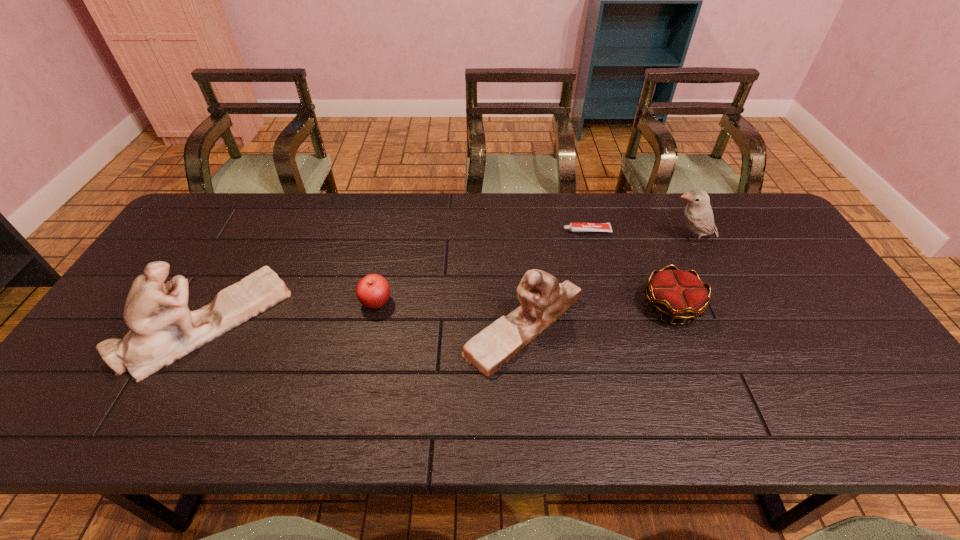
At what (x,y) coordinates should I click in order to perform the action: click on the leftmost object. Please return your answer as a coordinate pair (x, y). The width and height of the screenshot is (960, 540). Looking at the image, I should click on (162, 328).

Identify the location of the tallest object. This screenshot has width=960, height=540. (162, 328).

Where is `the right figurine`? the right figurine is located at coordinates (543, 299).

Find the location of `toothpaste`. toothpaste is located at coordinates (574, 226).

Identify the location of crown. This screenshot has width=960, height=540. (677, 294).

The image size is (960, 540). In order to click on bird in this screenshot , I will do `click(698, 214)`.

The height and width of the screenshot is (540, 960). In order to click on apple in this screenshot , I will do `click(373, 291)`.

What are the coordinates of `free space located 0.170m on the front-facing side of the left figurine` in the screenshot? It's located at (346, 323).

The height and width of the screenshot is (540, 960). Identify the location of blank space located on the front-facing side of the right figurine. (415, 327).

Identify the location of vacant space located 0.270m on the front-facing side of the right figurine. (356, 327).